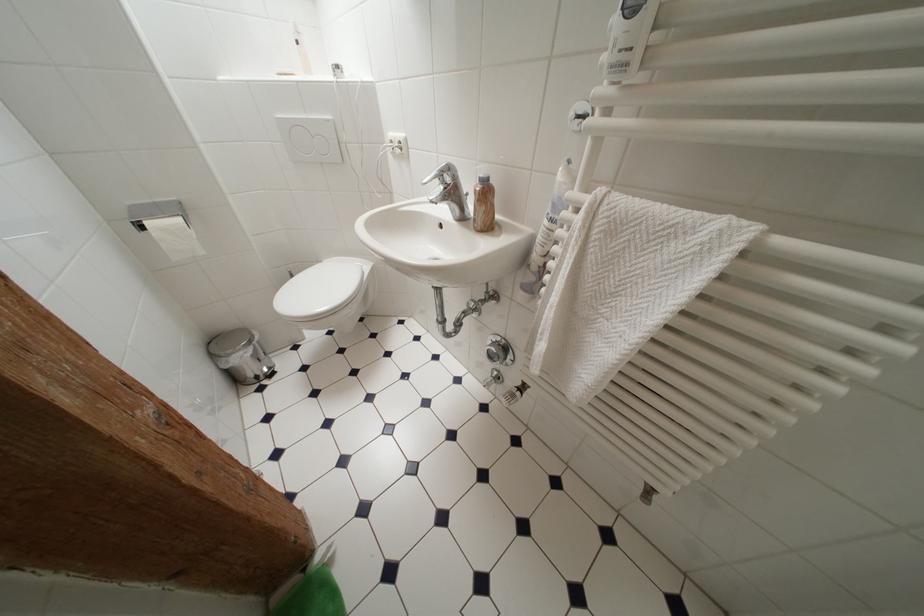
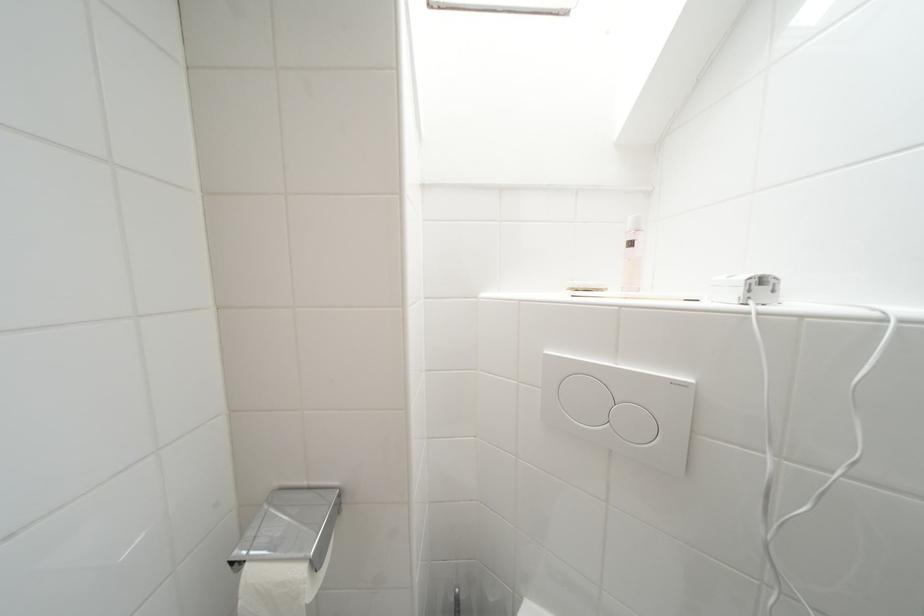
The point at (x=187, y=223) is marked in the first image. Where is the corresponding point in the second image?

(309, 575)